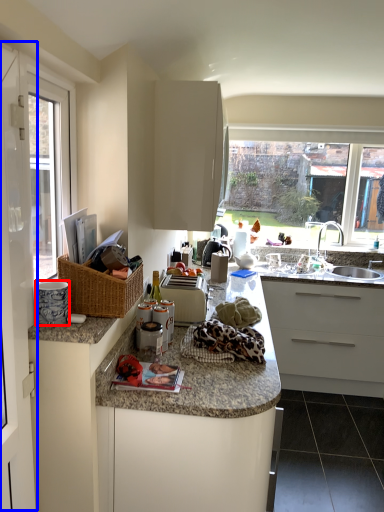
Question: Which point is closer to the camera, appliance (highlighted by a red box) or screen door (highlighted by a blue box)?

Choices:
 (A) appliance
 (B) screen door

Answer: (B)